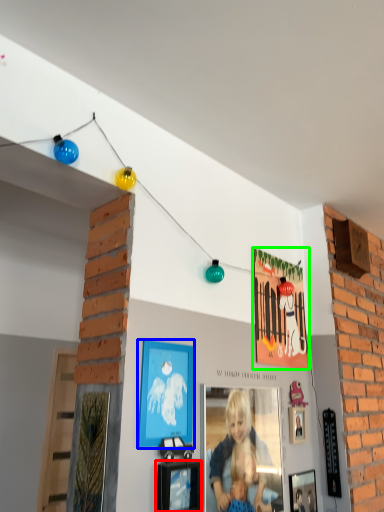
Question: Which is farther away from picture frame (highlighted by a red box)? picture frame (highlighted by a blue box) or picture frame (highlighted by a green box)?

Choices:
 (A) picture frame
 (B) picture frame

Answer: (B)